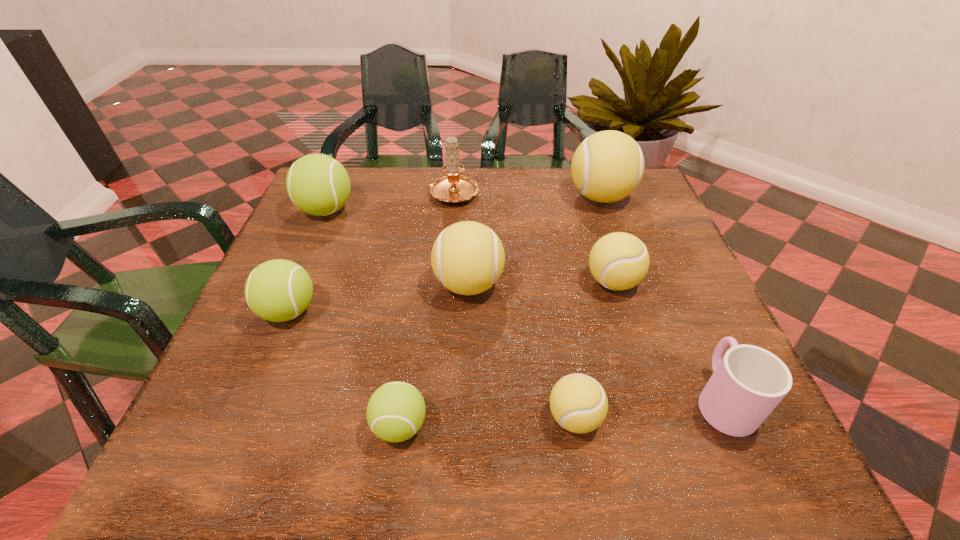
Where is `vacant space situated 0.050m with the handle on the side of the cup`? The height and width of the screenshot is (540, 960). vacant space situated 0.050m with the handle on the side of the cup is located at coordinates (698, 343).

Where is `vacant area situated 0.240m on the left of the third tennis ball from right to left`? The height and width of the screenshot is (540, 960). vacant area situated 0.240m on the left of the third tennis ball from right to left is located at coordinates (400, 417).

Identify the location of vacant space located on the left of the smallest green tennis ball. (242, 426).

Locate an element on the screen. This screenshot has height=540, width=960. candle present at the far edge is located at coordinates (453, 188).

Identify the location of cup that is positioned at the near edge. (749, 382).

Find the location of `cup at the right edge`. cup at the right edge is located at coordinates (749, 382).

The height and width of the screenshot is (540, 960). Identify the location of object present at the far left corner. (317, 184).

You are a GUI agent. You are given a task and a screenshot of the screen. Output one action in this format:
    pyautogui.click(x=<x>, y=<y>)
    Task: Click on the object positioned at the far right corner
    The width and height of the screenshot is (960, 540).
    Given the screenshot: What is the action you would take?
    pyautogui.click(x=607, y=166)

Image resolution: width=960 pixels, height=540 pixels. I want to click on object that is at the near right corner, so click(749, 382).

The height and width of the screenshot is (540, 960). What are the coordinates of `vacant region at the far edge` in the screenshot? It's located at (381, 192).